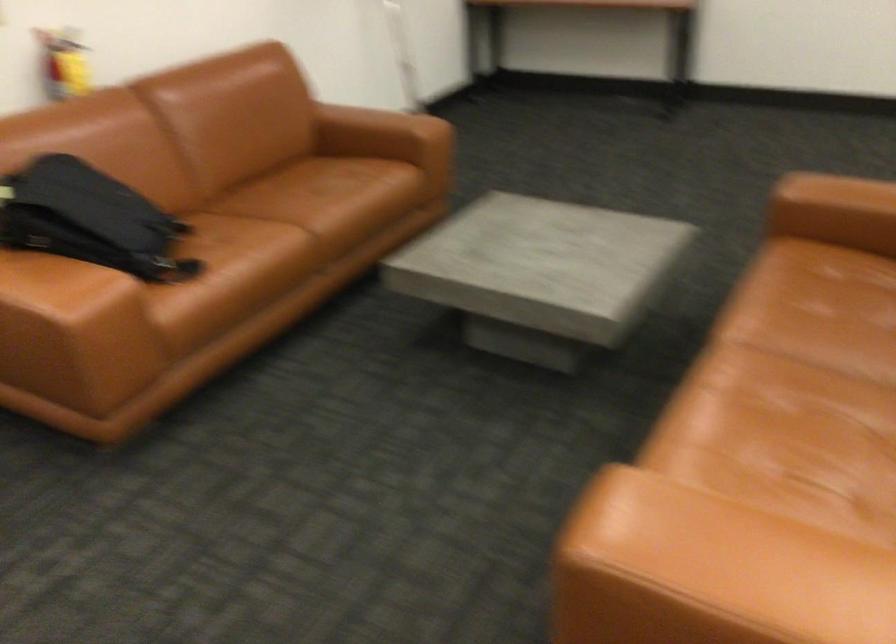
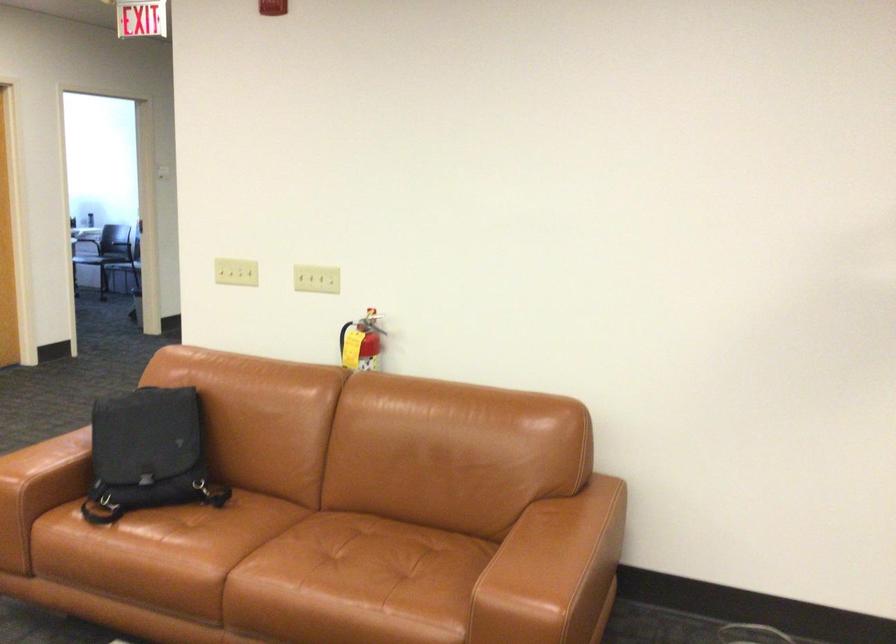
Find the pixel in the second image that matches point 106,267 in the first image.

(49, 467)